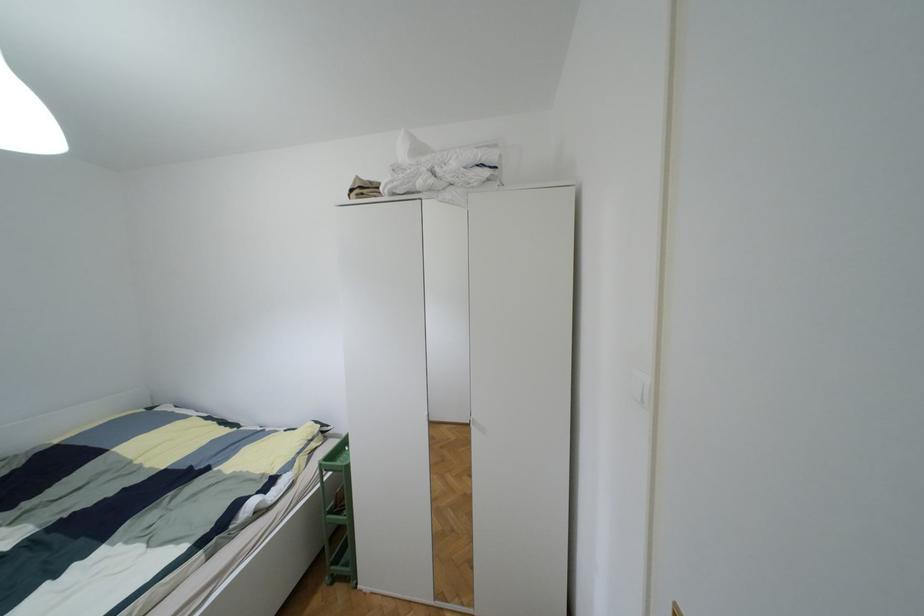
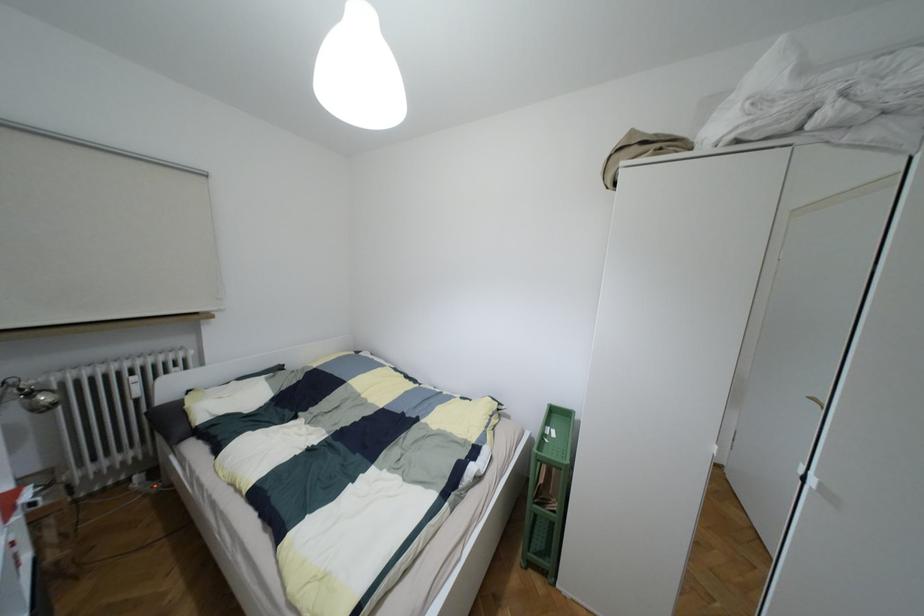
Question: The first image is from the beginning of the video and the second image is from the end. How did the camera likely rotate when shooting the video?

Choices:
 (A) Left
 (B) Right
 (C) Up
 (D) Down

Answer: (A)